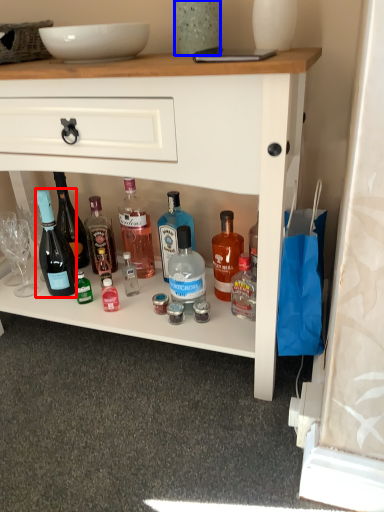
Question: Which object is further to the camera taking this photo, bottle (highlighted by a red box) or glass vase (highlighted by a blue box)?

Choices:
 (A) bottle
 (B) glass vase

Answer: (A)